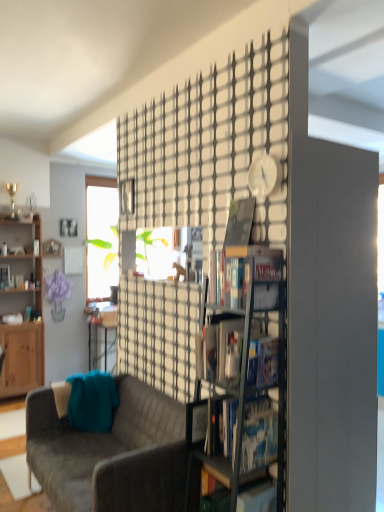
Question: Is matte black magazine at center spatially inside hardcover book at center, placed as the 5th book when sorted from bottom to top, or outside of it?

Choices:
 (A) outside
 (B) inside

Answer: (A)

Question: Looking at their shapes, would you say matte black magazine at center is wider or thinner than hardcover book at center, placed as the 5th book when sorted from bottom to top?

Choices:
 (A) wide
 (B) thin

Answer: (B)

Question: Which object is the closest to the wooden bookcase at left?

Choices:
 (A) hardcover book at center, which is the 5th book from front to back
 (B) velvet gray couch at lower left
 (C) matte black bookshelf at center, positioned as the 4th book in left-to-right order
 (D) hardcover book at center, the 4th book when ordered from front to back
 (E) clear glass bookshelf at center

Answer: (B)

Question: Which object is positioned farthest from the hardcover book at center, placed as the 2th book when sorted from top to bottom?

Choices:
 (A) hardcover book at center, the 5th book in the back-to-front sequence
 (B) matte black bookshelf at left, acting as the 1th book starting from the left
 (C) matte black bookshelf at center, positioned as the 4th book in left-to-right order
 (D) hardcover book at center, the 6th book positioned from the top
 (E) hardcover book at center, placed as the 6th book when sorted from bottom to top

Answer: (B)